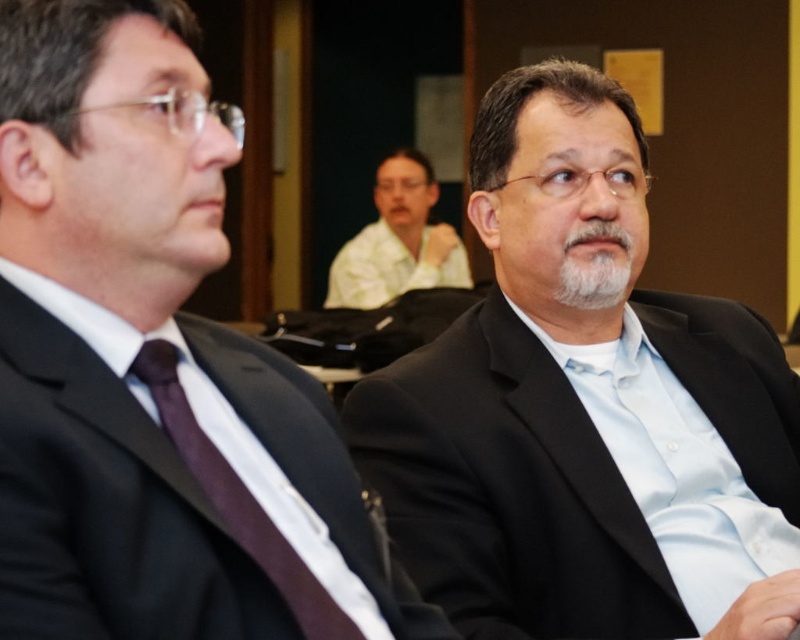
Question: Considering the real-world distances, which object is closest to the black suit at center?

Choices:
 (A) light beige shirt at center
 (B) black matte suit at center
 (C) dark purple silk tie at left

Answer: (C)

Question: Which object is positioned closest to the black matte suit at center?

Choices:
 (A) dark purple silk tie at left
 (B) light beige shirt at center
 (C) black suit at center

Answer: (C)

Question: Can you confirm if black matte suit at center is wider than light beige shirt at center?

Choices:
 (A) no
 (B) yes

Answer: (B)

Question: Estimate the real-world distances between objects in this image. Which object is farther from the dark purple silk tie at left?

Choices:
 (A) black matte suit at center
 (B) light beige shirt at center

Answer: (B)

Question: From the image, what is the correct spatial relationship of black suit at center in relation to dark purple silk tie at left?

Choices:
 (A) left
 (B) right

Answer: (A)

Question: Does dark purple silk tie at left appear on the right side of light beige shirt at center?

Choices:
 (A) yes
 (B) no

Answer: (B)